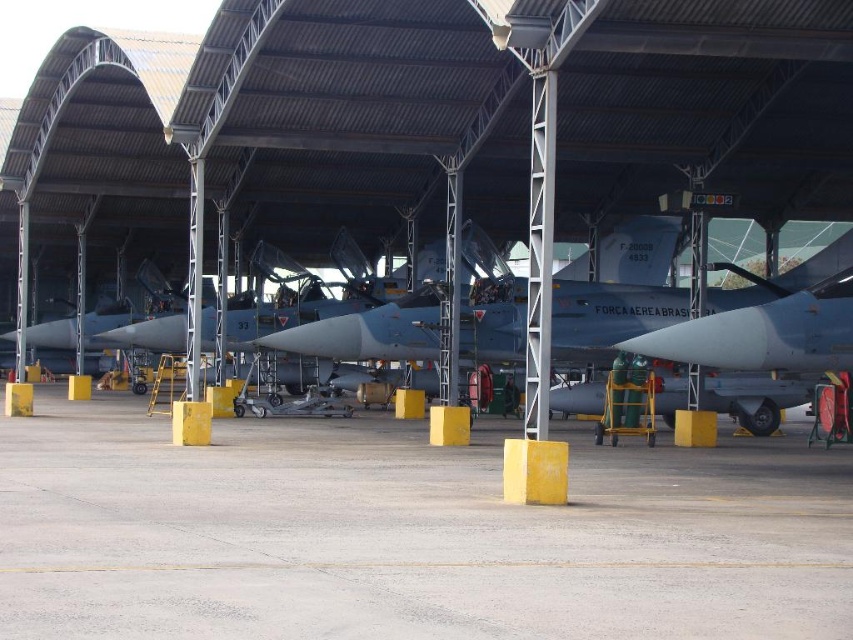
Question: In this image, where is gray concrete tarmac at center located relative to matte gray jet at center?

Choices:
 (A) right
 (B) left

Answer: (B)

Question: Is gray concrete tarmac at center closer to camera compared to matte gray jet at center?

Choices:
 (A) yes
 (B) no

Answer: (A)

Question: Is gray concrete tarmac at center to the right of matte gray jet at center from the viewer's perspective?

Choices:
 (A) yes
 (B) no

Answer: (B)

Question: Which point appears closest to the camera in this image?

Choices:
 (A) (505, 531)
 (B) (751, 404)

Answer: (A)

Question: Which of the following is the closest to the observer?

Choices:
 (A) [x=802, y=518]
 (B) [x=490, y=333]

Answer: (A)